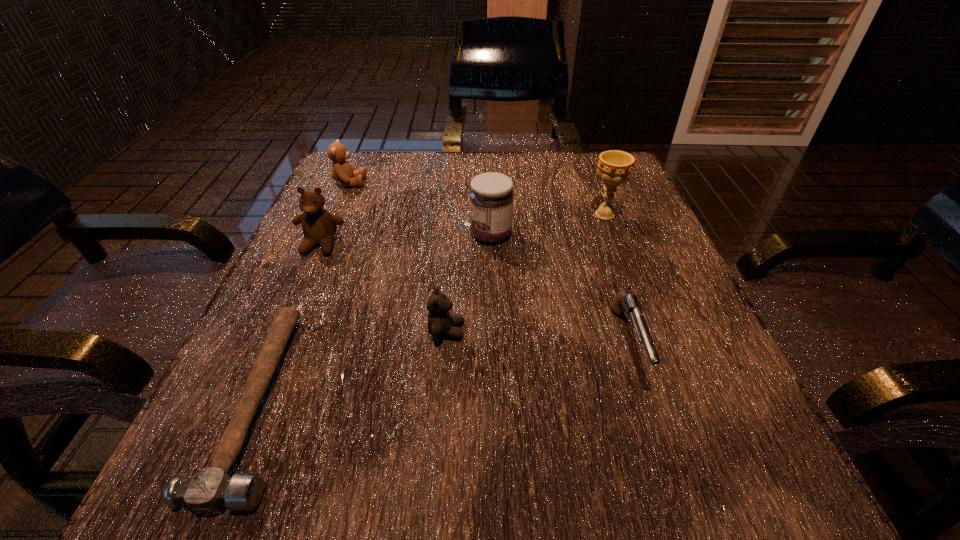
I want to click on vacant position in the image that satisfies the following two spatial constraints: 1. on the front label of the jam; 2. at the face of the tallest teddy bear, so click(x=492, y=245).

What are the coordinates of `vacant space that satisfies the following two spatial constraints: 1. on the front side of the chalice; 2. on the striking face of the hammer` in the screenshot? It's located at (674, 401).

You are a GUI agent. You are given a task and a screenshot of the screen. Output one action in this format:
    pyautogui.click(x=<x>, y=<y>)
    Task: Click on the free space that satisfies the following two spatial constraints: 1. on the front side of the chalice; 2. on the front label of the jam
    
    Given the screenshot: What is the action you would take?
    pyautogui.click(x=612, y=234)

Find the location of a particular element. vacant position in the image that satisfies the following two spatial constraints: 1. on the front side of the chalice; 2. on the striking face of the shortest object is located at coordinates (674, 401).